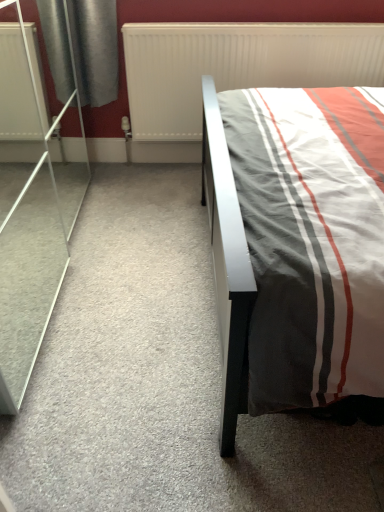
Question: Looking at their shapes, would you say white textured radiator at upper center is wider or thinner than transparent glass screen door at left?

Choices:
 (A) thin
 (B) wide

Answer: (A)

Question: Would you say white textured radiator at upper center is inside or outside transparent glass screen door at left?

Choices:
 (A) inside
 (B) outside

Answer: (B)

Question: From the image's perspective, is white textured radiator at upper center located above or below transparent glass screen door at left?

Choices:
 (A) below
 (B) above

Answer: (B)

Question: Looking at their shapes, would you say transparent glass screen door at left is wider or thinner than white textured radiator at upper center?

Choices:
 (A) thin
 (B) wide

Answer: (B)

Question: Based on their positions, is transparent glass screen door at left located to the left or right of white textured radiator at upper center?

Choices:
 (A) left
 (B) right

Answer: (A)

Question: From a real-world perspective, relative to white textured radiator at upper center, is transparent glass screen door at left vertically above or below?

Choices:
 (A) below
 (B) above

Answer: (B)

Question: Do you think transparent glass screen door at left is within white textured radiator at upper center, or outside of it?

Choices:
 (A) outside
 (B) inside

Answer: (A)